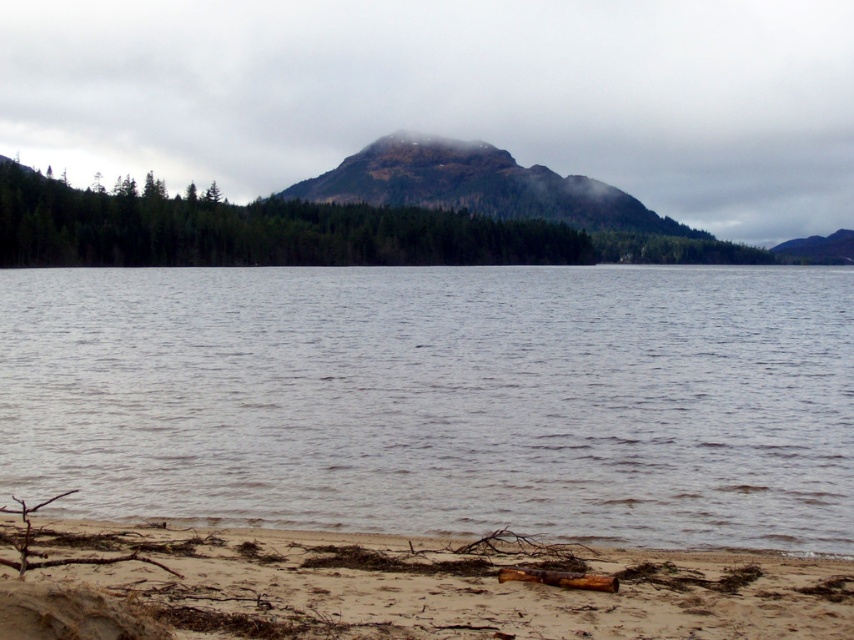
Is point (173, 468) less distant than point (636, 634)?

No, it is behind (636, 634).

Is gray water at center to the right of brown sandy beach at lower left from the viewer's perspective?

No, gray water at center is not to the right of brown sandy beach at lower left.

Find the location of a particular element. This screenshot has width=854, height=640. gray water at center is located at coordinates (440, 397).

Is foggy mountain at upper center above brown sandy beach at lower left?

Yes.

Which is above, foggy mountain at upper center or brown sandy beach at lower left?

foggy mountain at upper center is higher up.

Is point (162, 44) positioned after point (425, 552)?

Yes.

Locate an element on the screen. The width and height of the screenshot is (854, 640). foggy mountain at upper center is located at coordinates (449, 96).

Does foggy mountain at upper center come behind green matte forest at center?

That is True.

Image resolution: width=854 pixels, height=640 pixels. Identify the location of foggy mountain at upper center. (449, 96).